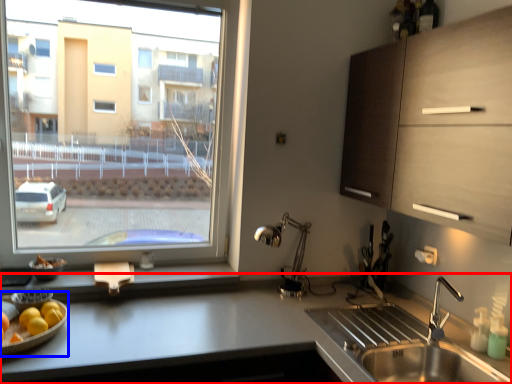
Question: Which object is further to the camera taking this photo, countertop (highlighted by a red box) or fruit dish (highlighted by a blue box)?

Choices:
 (A) countertop
 (B) fruit dish

Answer: (B)